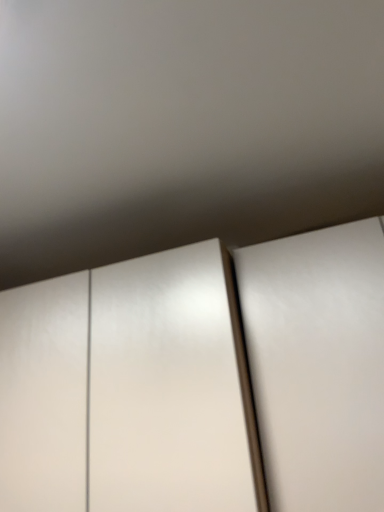
Where is `white glossy door at right`? white glossy door at right is located at coordinates (318, 365).

In order to face white glossy door at right, should I rotate leftwards or rightwards?

Rotate right and turn 18.580 degrees.

Image resolution: width=384 pixels, height=512 pixels. Describe the element at coordinates (318, 365) in the screenshot. I see `white glossy door at right` at that location.

Locate an element on the screen. The image size is (384, 512). white glossy cupboard at center is located at coordinates (129, 390).

Describe the element at coordinates (129, 390) in the screenshot. This screenshot has width=384, height=512. I see `white glossy cupboard at center` at that location.

In order to click on white glossy door at right in this screenshot , I will do `click(318, 365)`.

Is white glossy door at right at the right side of white glossy cupboard at center?

Indeed, white glossy door at right is positioned on the right side of white glossy cupboard at center.

In the scene shown: Is white glossy door at right in front of or behind white glossy cupboard at center in the image?

Visually, white glossy door at right is located in front of white glossy cupboard at center.

Considering the positions of point (257, 282) and point (273, 293), is point (257, 282) closer or farther from the camera than point (273, 293)?

Point (257, 282).

Consider the image. From the image's perspective, who appears lower, white glossy door at right or white glossy cupboard at center?

white glossy cupboard at center is shown below in the image.

Based on the photo, from a real-world perspective, which object stands above the other?

white glossy cupboard at center is physically above.

Between white glossy door at right and white glossy cupboard at center, which one has larger width?

white glossy door at right.

Can you confirm if white glossy door at right is taller than white glossy cupboard at center?

Yes.

Considering the sizes of objects white glossy door at right and white glossy cupboard at center in the image provided, who is smaller, white glossy door at right or white glossy cupboard at center?

white glossy door at right.

Which is correct: white glossy door at right is inside white glossy cupboard at center, or outside of it?

white glossy door at right is not enclosed by white glossy cupboard at center.

Are white glossy door at right and white glossy cupboard at center far apart?

They are positioned close to each other.

Could you tell me if white glossy door at right is turned towards white glossy cupboard at center?

No, white glossy door at right is not turned towards white glossy cupboard at center.

At what (x,y) coordinates should I click in order to perform the action: click on cupboard behind the white glossy door at right. Please return your answer as a coordinate pair (x, y). Looking at the image, I should click on (129, 390).

Based on the photo, considering the relative positions of white glossy cupboard at center and white glossy door at right in the image provided, is white glossy cupboard at center to the left or to the right of white glossy door at right?

white glossy cupboard at center is positioned on white glossy door at right's left side.

Is white glossy cupboard at center in front of or behind white glossy door at right in the image?

In the image, white glossy cupboard at center appears behind white glossy door at right.

Which point is more forward, (93, 277) or (371, 477)?

Positioned in front is point (371, 477).

From the image's perspective, between white glossy cupboard at center and white glossy door at right, who is located below?

white glossy cupboard at center, from the image's perspective.

From a real-world perspective, is white glossy cupboard at center physically located above or below white glossy door at right?

white glossy cupboard at center is situated higher than white glossy door at right in the real world.

From the picture: Can you confirm if white glossy cupboard at center is wider than white glossy door at right?

Incorrect, the width of white glossy cupboard at center does not surpass that of white glossy door at right.

Is white glossy cupboard at center taller or shorter than white glossy door at right?

white glossy cupboard at center is shorter than white glossy door at right.

Does white glossy cupboard at center have a larger size compared to white glossy door at right?

Indeed, white glossy cupboard at center has a larger size compared to white glossy door at right.

Do you think white glossy cupboard at center is within white glossy door at right, or outside of it?

white glossy cupboard at center is not enclosed by white glossy door at right.

Would you consider white glossy cupboard at center to be distant from white glossy door at right?

That's not correct — white glossy cupboard at center is a little close to white glossy door at right.

Is white glossy cupboard at center facing towards white glossy door at right?

No.

Can you tell me how much white glossy cupboard at center and white glossy door at right differ in facing direction?

The facing directions of white glossy cupboard at center and white glossy door at right are 0.000793 degrees apart.

Find the location of a particular element. cupboard on the left of white glossy door at right is located at coordinates (129, 390).

Find the location of `door below the white glossy cupboard at center (from a real-world perspective)`. door below the white glossy cupboard at center (from a real-world perspective) is located at coordinates (318, 365).

In order to click on cupboard that is on the left side of white glossy door at right in this screenshot , I will do `click(129, 390)`.